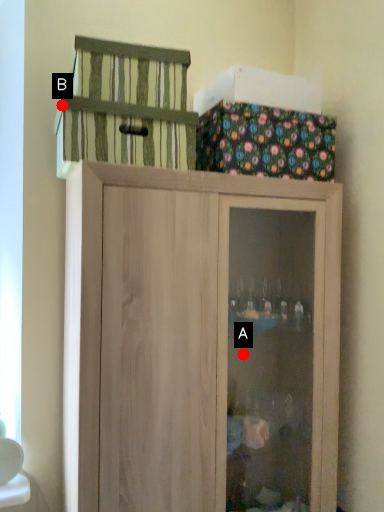
Question: Two points are circled on the image, labeled by A and B beside each circle. Which of the following is the closest to the observer?

Choices:
 (A) A is closer
 (B) B is closer

Answer: (B)